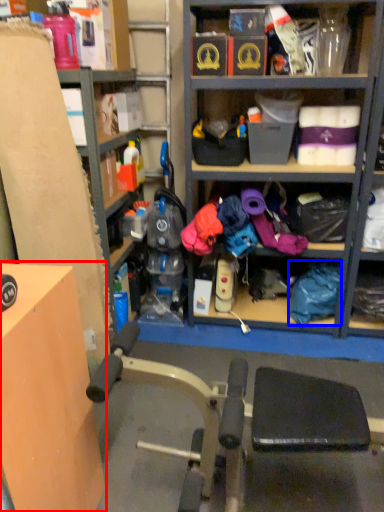
Question: Which object is closer to the camera taking this photo, table (highlighted by a red box) or clothing (highlighted by a blue box)?

Choices:
 (A) table
 (B) clothing

Answer: (A)